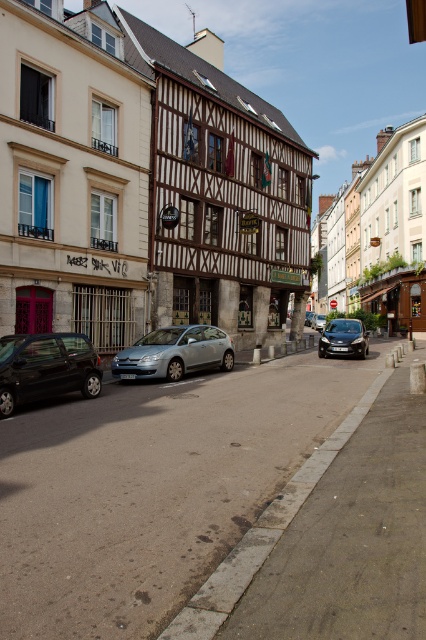
Question: Is white wooden building at center further to camera compared to shiny black car at lower left?

Choices:
 (A) no
 (B) yes

Answer: (B)

Question: Is satin black car at center below satin silver sedan at center?

Choices:
 (A) no
 (B) yes

Answer: (B)

Question: Considering the real-world distances, which object is farthest from the satin silver car at center?

Choices:
 (A) brown wooden building at center
 (B) white wooden building at center

Answer: (B)

Question: Is satin silver car at center bigger than satin black car at center?

Choices:
 (A) no
 (B) yes

Answer: (B)

Question: Which of the following is the closest to the observer?

Choices:
 (A) satin black car at center
 (B) white wooden building at center
 (C) brown wooden building at center

Answer: (C)

Question: Among these points, which one is farthest from the camera?

Choices:
 (A) (184, 337)
 (B) (176, 250)
 (C) (350, 204)

Answer: (C)